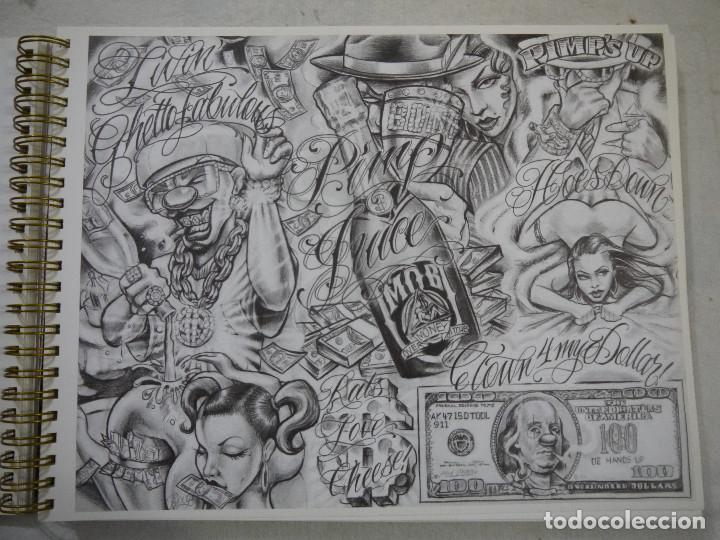
The image size is (720, 540). I want to click on liquor bottle, so (x=435, y=238), (x=122, y=248).